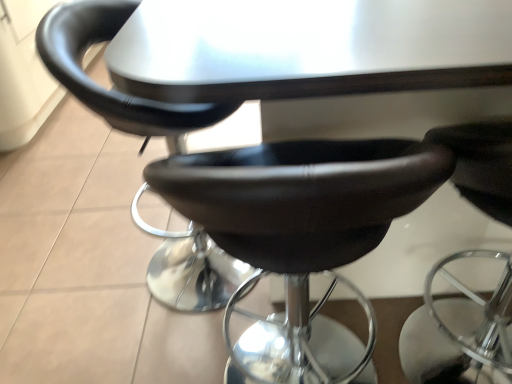
Question: Considering the relative sizes of black leather chair at center, placed as the 1th chair when sorted from right to left, and matte black stool at center, which is counted as the 3th chair, starting from the right, in the image provided, is black leather chair at center, placed as the 1th chair when sorted from right to left, taller than matte black stool at center, which is counted as the 3th chair, starting from the right,?

Choices:
 (A) no
 (B) yes

Answer: (A)

Question: Does black leather chair at center, the third chair when ordered from left to right, have a smaller size compared to matte black stool at center, which is counted as the 3th chair, starting from the right?

Choices:
 (A) yes
 (B) no

Answer: (A)

Question: Can you confirm if black leather chair at center, placed as the 1th chair when sorted from right to left, is thinner than matte black stool at center, acting as the first chair starting from the left?

Choices:
 (A) no
 (B) yes

Answer: (A)

Question: From a real-world perspective, is black leather chair at center, placed as the 1th chair when sorted from right to left, physically above matte black stool at center, which is counted as the 3th chair, starting from the right?

Choices:
 (A) no
 (B) yes

Answer: (A)

Question: Is the depth of black leather chair at center, the third chair when ordered from left to right, greater than that of matte black stool at center, which is counted as the 3th chair, starting from the right?

Choices:
 (A) yes
 (B) no

Answer: (B)

Question: Is black leather stool at center, acting as the 2th chair starting from the left, inside or outside of matte black stool at center, acting as the first chair starting from the left?

Choices:
 (A) outside
 (B) inside

Answer: (A)

Question: Looking at the image, does black leather stool at center, which is counted as the second chair, starting from the right, seem bigger or smaller compared to matte black stool at center, which is counted as the 3th chair, starting from the right?

Choices:
 (A) big
 (B) small

Answer: (B)

Question: In terms of height, does black leather stool at center, which is counted as the second chair, starting from the right, look taller or shorter compared to matte black stool at center, acting as the first chair starting from the left?

Choices:
 (A) tall
 (B) short

Answer: (B)

Question: Is point (230, 195) closer or farther from the camera than point (53, 64)?

Choices:
 (A) farther
 (B) closer

Answer: (B)

Question: Does point (133, 132) appear closer or farther from the camera than point (334, 167)?

Choices:
 (A) closer
 (B) farther

Answer: (B)

Question: From a real-world perspective, is matte black stool at center, acting as the first chair starting from the left, physically located above or below black leather stool at center, which is counted as the second chair, starting from the right?

Choices:
 (A) above
 (B) below

Answer: (A)

Question: Visually, is matte black stool at center, acting as the first chair starting from the left, positioned to the left or to the right of black leather stool at center, which is counted as the second chair, starting from the right?

Choices:
 (A) left
 (B) right

Answer: (A)

Question: Considering their positions, is matte black stool at center, acting as the first chair starting from the left, located in front of or behind black leather stool at center, acting as the 2th chair starting from the left?

Choices:
 (A) front
 (B) behind

Answer: (B)

Question: Does point (x=412, y=354) appear closer or farther from the camera than point (x=220, y=210)?

Choices:
 (A) farther
 (B) closer

Answer: (A)

Question: Looking at the image, does black leather chair at center, placed as the 1th chair when sorted from right to left, seem bigger or smaller compared to black leather stool at center, which is counted as the second chair, starting from the right?

Choices:
 (A) big
 (B) small

Answer: (B)